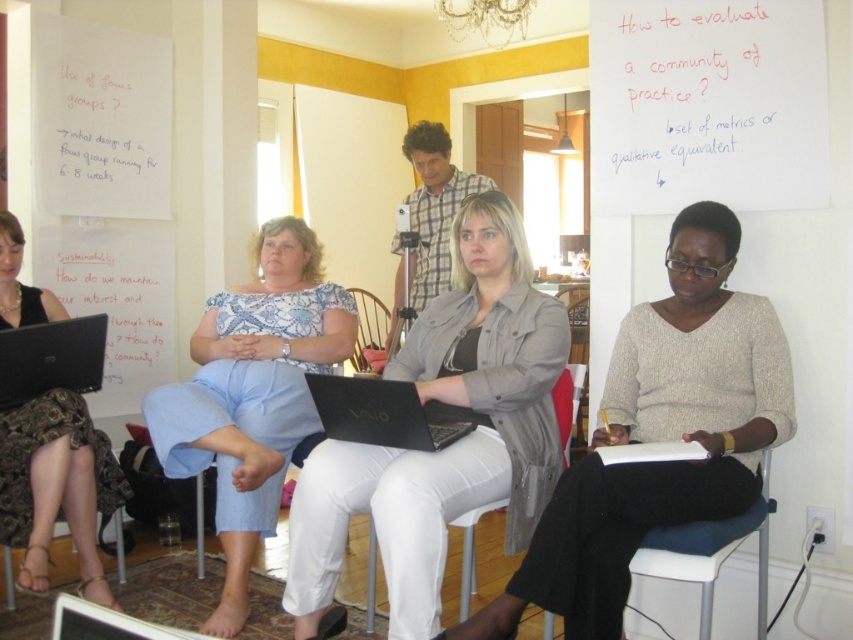
You are a participant in the workshop and need to write on the whiteboard at upper right. Can you comfortably reach it while standing next to the black textured skirt at lower left?

The whiteboard at upper right is not as tall as the black textured skirt at lower left, meaning it is shorter. Since the skirt is at your lower left, it might not obstruct your reach. However, the whiteboard being shorter could make it easier to reach, but the exact height needed for comfort isn

You are a photographer positioned at the entrance of the room. You need to capture a photo that includes both the light gray fabric jacket at center and the matte black laptop at lower left. Based on their positions, which object should you focus on first to ensure both are in the frame?

The light gray fabric jacket at center is below the matte black laptop at lower left, so you should focus on the matte black laptop at lower left first to ensure both are captured in the frame.

You are organizing a clothing donation drive and need to stack jackets. You have a matte gray jacket at center and a light gray fabric jacket at center. Which jacket should you place on top to ensure the one underneath is protected from potential spills?

The matte gray jacket at center should be placed on top of the light gray fabric jacket at center because it is positioned over it, providing better protection from spills.